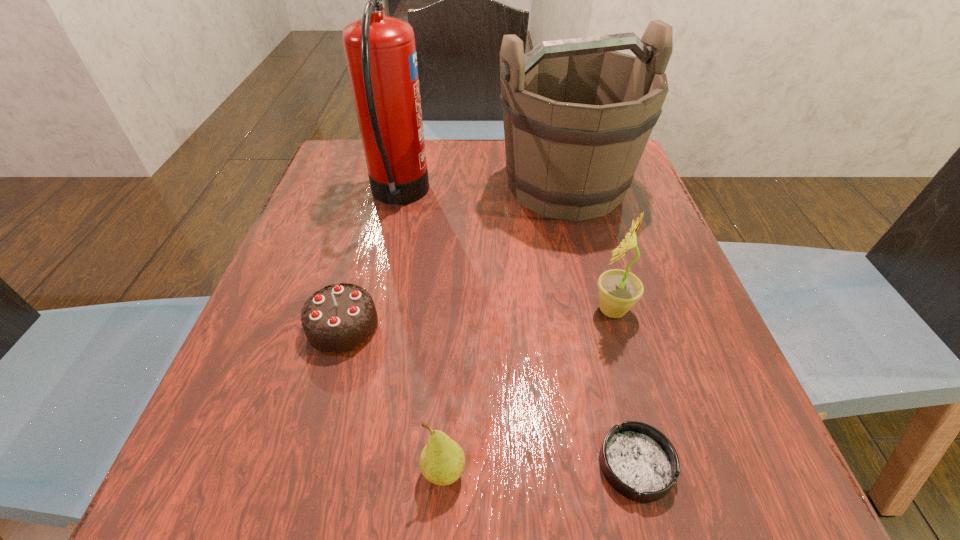
Identify the location of the tallest object. (380, 51).

Identify the location of the fifth shortest object. tap(577, 114).

Identify the location of the third tallest object. The image size is (960, 540). (618, 290).

Where is `pear`? The image size is (960, 540). pear is located at coordinates (442, 461).

Where is `the third object from left to right`? This screenshot has height=540, width=960. the third object from left to right is located at coordinates (442, 461).

This screenshot has width=960, height=540. Identify the location of the second shortest object. pos(338,319).

You are a GUI agent. You are given a task and a screenshot of the screen. Output one action in this format:
    pyautogui.click(x=<x>, y=<y>)
    Task: Click on the shortest object
    The height and width of the screenshot is (540, 960).
    Given the screenshot: What is the action you would take?
    tap(638, 461)

Locate an element on the screen. The width and height of the screenshot is (960, 540). vacant space located on the surface of the tallest object is located at coordinates (559, 196).

This screenshot has width=960, height=540. Identify the location of vacant space located on the front of the second tallest object. (615, 389).

Image resolution: width=960 pixels, height=540 pixels. Find the location of `vacant space located 0.200m on the face of the fourth shortest object`. vacant space located 0.200m on the face of the fourth shortest object is located at coordinates (475, 310).